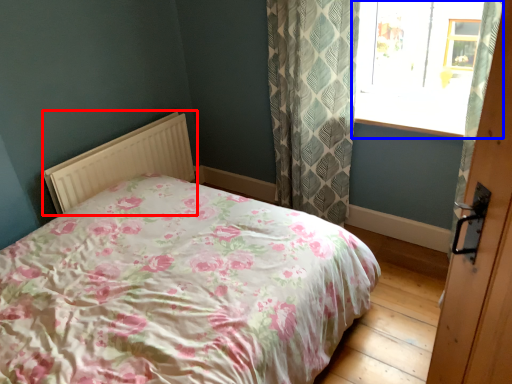
Question: Which point is further to the camera, radiator (highlighted by a red box) or window (highlighted by a blue box)?

Choices:
 (A) radiator
 (B) window

Answer: (A)